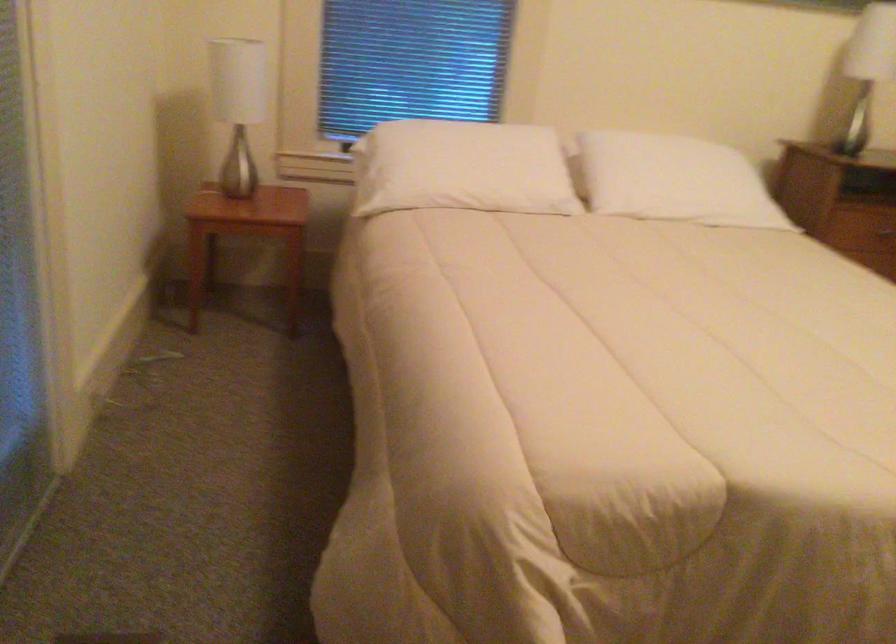
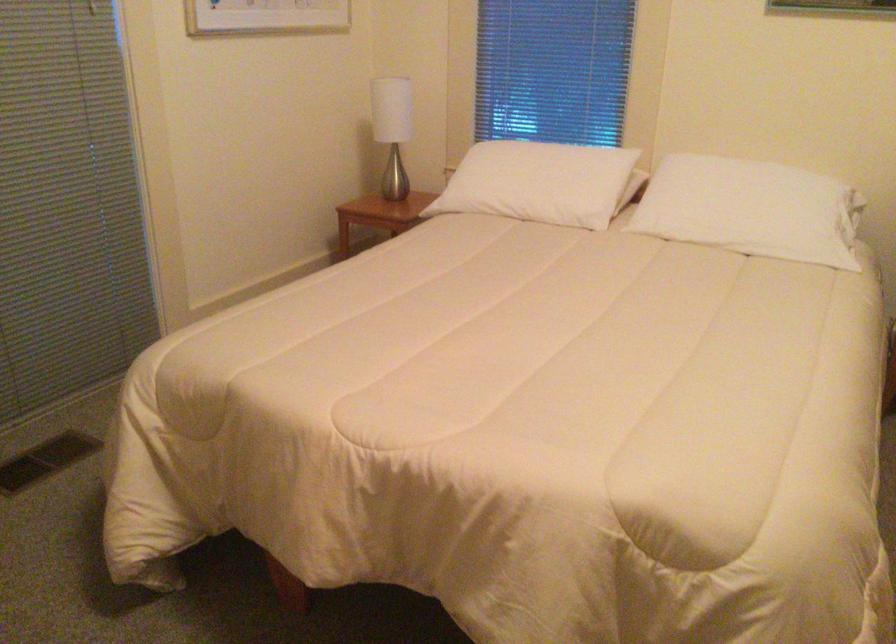
Where in the second image is the point corresponding to pixel 257 114 from the first image?

(392, 129)